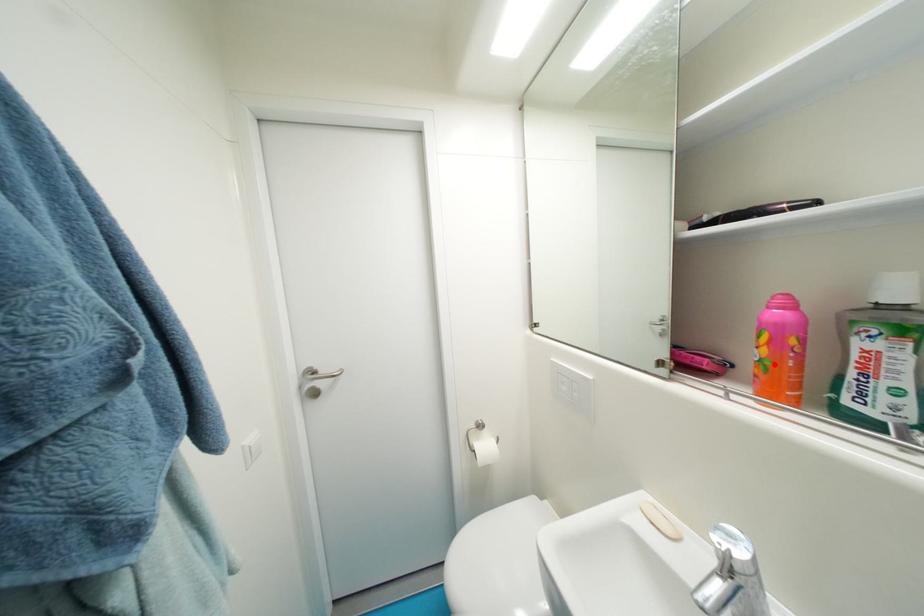
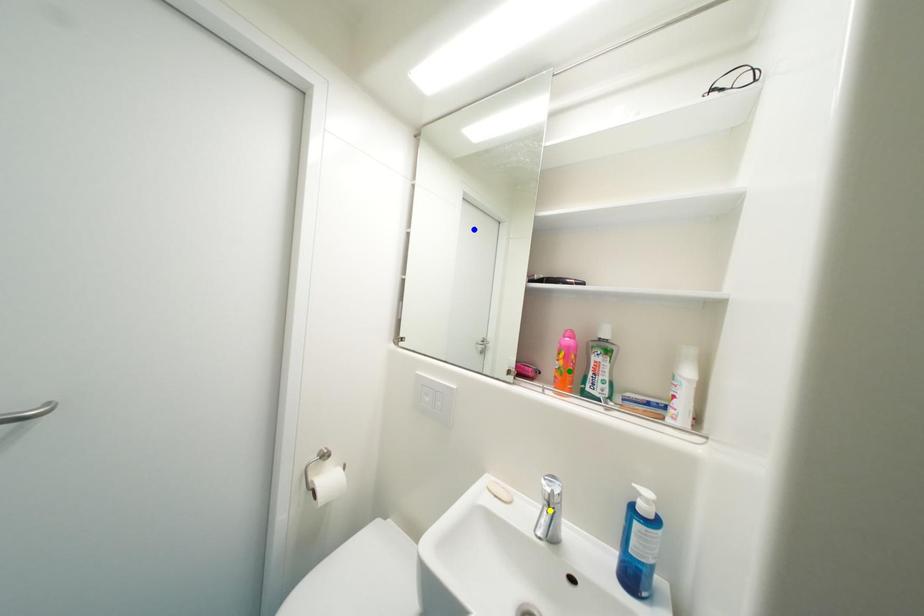
Question: I am providing you with two images of the same scene from different viewpoints. A red point is marked on the first image. You are given multiple points on the second image. Which point in image 2 is actually the same real-world point as the red point in image 1?

Choices:
 (A) blue point
 (B) green point
 (C) yellow point

Answer: (B)